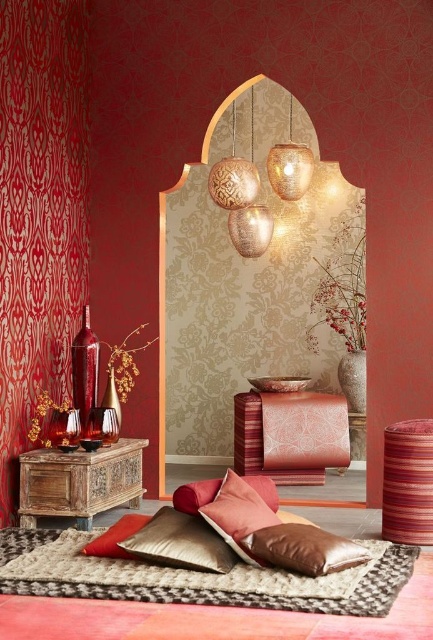
Question: Which point appears farthest from the camera in this image?

Choices:
 (A) (100, 461)
 (B) (84, 545)

Answer: (A)

Question: Can you confirm if wooden carved chest at lower left is bigger than striped fabric stool at lower right?

Choices:
 (A) no
 (B) yes

Answer: (B)

Question: Which point is farther to the camera?

Choices:
 (A) velvet cushion at lower left
 (B) metallic textured lantern at upper center
 (C) velvet cushion at lower center
 (D) matte pink fabric cushion at center

Answer: (D)

Question: Can you confirm if red velvet curtain at left is bigger than striped fabric stool at lower right?

Choices:
 (A) yes
 (B) no

Answer: (A)

Question: Considering the real-world distances, which object is closest to the velvet cushion at lower left?

Choices:
 (A) metallic textured lantern at upper center
 (B) shiny brown pillow at lower center

Answer: (B)

Question: Is matte pink fabric cushion at center smaller than textured brass lamp at upper center?

Choices:
 (A) yes
 (B) no

Answer: (B)